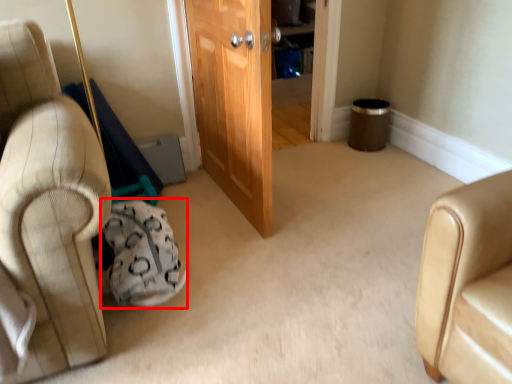
Question: From the image's perspective, considering the relative positions of bean bag chair (annotated by the red box) and door in the image provided, where is bean bag chair (annotated by the red box) located with respect to the staircase?

Choices:
 (A) above
 (B) below

Answer: (B)